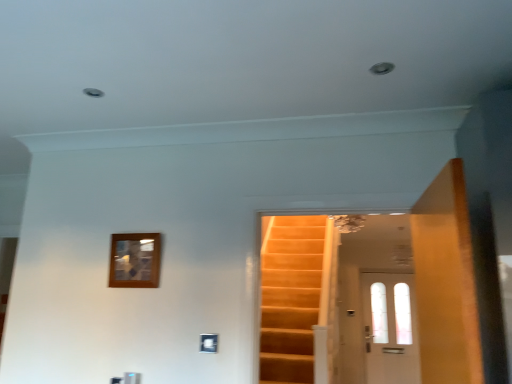
Measure the distance between white glass door at center, which is counted as the first door, starting from the back, and camera.

6.35 meters.

You are a GUI agent. You are given a task and a screenshot of the screen. Output one action in this format:
    pyautogui.click(x=<x>, y=<y>)
    Task: Click on the wooden picture frame at upper left
    
    Given the screenshot: What is the action you would take?
    pyautogui.click(x=135, y=260)

Where is `white glass door at center, which appears as the second door when viewed from the left`? white glass door at center, which appears as the second door when viewed from the left is located at coordinates (390, 328).

From a real-world perspective, who is located higher, wooden door at right, which is the 2th door from right to left, or wooden picture frame at upper left?

wooden picture frame at upper left.

Would you say wooden door at right, which is the second door in bottom-to-top order, is inside or outside wooden picture frame at upper left?

→ wooden door at right, which is the second door in bottom-to-top order, is not inside wooden picture frame at upper left, it's outside.

Locate an element on the screen. picture frame that is above the wooden door at right, positioned as the 1th door in left-to-right order (from a real-world perspective) is located at coordinates (135, 260).

Which is more to the right, wooden door at right, placed as the 1th door when sorted from front to back, or white glass door at center, marked as the first door in a right-to-left arrangement?

From the viewer's perspective, white glass door at center, marked as the first door in a right-to-left arrangement, appears more on the right side.

Is wooden door at right, which is counted as the second door, starting from the back, positioned with its back to white glass door at center, arranged as the second door when viewed from the front?

No, wooden door at right, which is counted as the second door, starting from the back, is not facing the opposite direction of white glass door at center, arranged as the second door when viewed from the front.

What's the angular difference between wooden door at right, which is counted as the second door, starting from the back, and white glass door at center, arranged as the second door when viewed from the front,'s facing directions?

The facing directions of wooden door at right, which is counted as the second door, starting from the back, and white glass door at center, arranged as the second door when viewed from the front, are 85.8 degrees apart.

Is wooden door at right, positioned as the 1th door in top-to-bottom order, positioned far away from white glass door at center, marked as the first door in a right-to-left arrangement?

Yes.

Considering the positions of objects wooden picture frame at upper left and wooden door at right, which is counted as the second door, starting from the back, in the image provided, who is more to the right, wooden picture frame at upper left or wooden door at right, which is counted as the second door, starting from the back,?

Positioned to the right is wooden door at right, which is counted as the second door, starting from the back.

Between wooden picture frame at upper left and wooden door at right, which is the second door in bottom-to-top order, which one has larger size?

wooden door at right, which is the second door in bottom-to-top order.

Measure the distance between wooden picture frame at upper left and wooden door at right, which is the 2th door from right to left.

The distance of wooden picture frame at upper left from wooden door at right, which is the 2th door from right to left, is 4.45 feet.

Is wooden picture frame at upper left located outside wooden door at right, which is the 2th door from right to left?

That's correct, wooden picture frame at upper left is outside of wooden door at right, which is the 2th door from right to left.

From the picture: Is wooden picture frame at upper left next to white glass door at center, arranged as the second door when viewed from the front, and touching it?

There is a gap between wooden picture frame at upper left and white glass door at center, arranged as the second door when viewed from the front.

Does wooden picture frame at upper left turn towards white glass door at center, marked as the first door in a right-to-left arrangement?

No.

Does wooden picture frame at upper left have a smaller size compared to white glass door at center, which appears as the second door when viewed from the left?

Yes.

From a real-world perspective, which object rests below the other?

white glass door at center, which ranks as the 2th door in top-to-bottom order, is physically lower.

Is white glass door at center, which is counted as the first door, starting from the back, wider than wooden picture frame at upper left?

Yes, white glass door at center, which is counted as the first door, starting from the back, is wider than wooden picture frame at upper left.

In the scene shown: Is white glass door at center, which appears as the second door when viewed from the left, closer to the viewer compared to wooden picture frame at upper left?

No, white glass door at center, which appears as the second door when viewed from the left, is behind wooden picture frame at upper left.

Where is `picture frame positioned vertically above the white glass door at center, which appears as the second door when viewed from the left (from a real-world perspective)`? Image resolution: width=512 pixels, height=384 pixels. picture frame positioned vertically above the white glass door at center, which appears as the second door when viewed from the left (from a real-world perspective) is located at coordinates (135, 260).

From the picture: Who is shorter, white glass door at center, which appears as the second door when viewed from the left, or wooden picture frame at upper left?

With less height is wooden picture frame at upper left.

Which is correct: white glass door at center, which ranks as the 2th door in top-to-bottom order, is inside wooden door at right, which is the second door in bottom-to-top order, or outside of it?

The correct answer is: outside.

Considering the sizes of objects white glass door at center, which ranks as the 2th door in top-to-bottom order, and wooden door at right, which is the second door in bottom-to-top order, in the image provided, who is smaller, white glass door at center, which ranks as the 2th door in top-to-bottom order, or wooden door at right, which is the second door in bottom-to-top order,?

Smaller between the two is wooden door at right, which is the second door in bottom-to-top order.

From a real-world perspective, is white glass door at center, which ranks as the 2th door in top-to-bottom order, positioned above or below wooden door at right, which is the second door in bottom-to-top order?

Clearly, from a real-world perspective, white glass door at center, which ranks as the 2th door in top-to-bottom order, is below wooden door at right, which is the second door in bottom-to-top order.

Considering their positions, is white glass door at center, marked as the first door in a right-to-left arrangement, located in front of or behind wooden door at right, which is the second door in bottom-to-top order?

white glass door at center, marked as the first door in a right-to-left arrangement, is behind wooden door at right, which is the second door in bottom-to-top order.

Identify the location of door above the wooden picture frame at upper left (from the image's perspective). The image size is (512, 384). (446, 281).

Identify the location of door that is above the white glass door at center, which ranks as the 2th door in top-to-bottom order (from a real-world perspective). (446, 281).

Based on their spatial positions, is wooden picture frame at upper left or wooden door at right, which is counted as the second door, starting from the back, further from white glass door at center, which appears as the second door when viewed from the left?

wooden picture frame at upper left lies further to white glass door at center, which appears as the second door when viewed from the left, than the other object.

Estimate the real-world distances between objects in this image. Which object is closer to wooden picture frame at upper left, white glass door at center, which is counted as the first door, starting from the back, or wooden door at right, which is counted as the second door, starting from the back?

Among the two, wooden door at right, which is counted as the second door, starting from the back, is located nearer to wooden picture frame at upper left.

Looking at the image, which one is located closer to wooden door at right, which is the second door in bottom-to-top order, white glass door at center, which is counted as the first door, starting from the back, or wooden picture frame at upper left?

wooden picture frame at upper left is positioned closer to the anchor wooden door at right, which is the second door in bottom-to-top order.

Which object lies further to the anchor point wooden picture frame at upper left, wooden door at right, which is the 2th door from right to left, or white glass door at center, which ranks as the 2th door in top-to-bottom order?

white glass door at center, which ranks as the 2th door in top-to-bottom order.

Considering their positions, is wooden picture frame at upper left positioned closer to wooden door at right, placed as the 1th door when sorted from front to back, than white glass door at center, arranged as the second door when viewed from the front?

wooden picture frame at upper left is positioned closer to the anchor wooden door at right, placed as the 1th door when sorted from front to back.

When comparing their distances from white glass door at center, which appears as the second door when viewed from the left, does wooden door at right, which is the second door in bottom-to-top order, or wooden picture frame at upper left seem closer?

wooden door at right, which is the second door in bottom-to-top order.

The width and height of the screenshot is (512, 384). Identify the location of picture frame positioned between wooden door at right, which is the second door in bottom-to-top order, and white glass door at center, which is counted as the first door, starting from the back, from near to far. (135, 260).